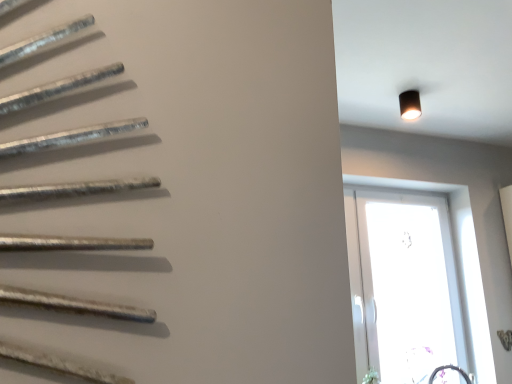
Question: Considering their positions, is transparent glass window at right located in front of or behind black matte light fixture at upper right?

Choices:
 (A) behind
 (B) front

Answer: (A)

Question: Visually, is transparent glass window at right positioned to the left or to the right of black matte light fixture at upper right?

Choices:
 (A) left
 (B) right

Answer: (B)

Question: Looking at their shapes, would you say transparent glass window at right is wider or thinner than black matte light fixture at upper right?

Choices:
 (A) thin
 (B) wide

Answer: (A)

Question: Considering the positions of black matte light fixture at upper right and transparent glass window at right in the image, is black matte light fixture at upper right taller or shorter than transparent glass window at right?

Choices:
 (A) tall
 (B) short

Answer: (B)

Question: Do you think black matte light fixture at upper right is within transparent glass window at right, or outside of it?

Choices:
 (A) inside
 (B) outside

Answer: (B)

Question: Considering the positions of point (404, 104) and point (484, 326), is point (404, 104) closer or farther from the camera than point (484, 326)?

Choices:
 (A) farther
 (B) closer

Answer: (B)

Question: From the image's perspective, is black matte light fixture at upper right located above or below transparent glass window at right?

Choices:
 (A) above
 (B) below

Answer: (A)